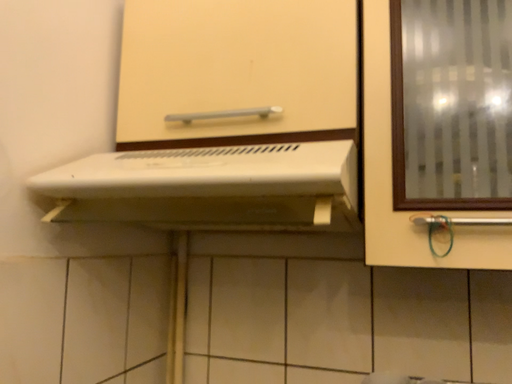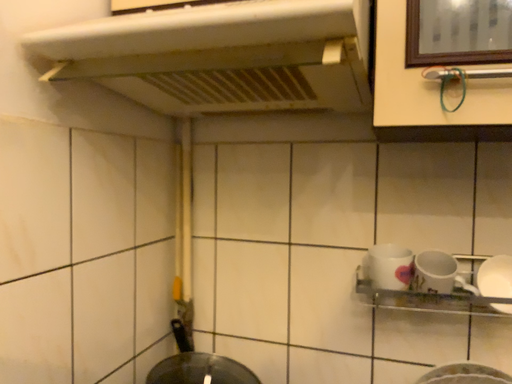
Question: How did the camera likely rotate when shooting the video?

Choices:
 (A) rotated upward
 (B) rotated downward

Answer: (B)